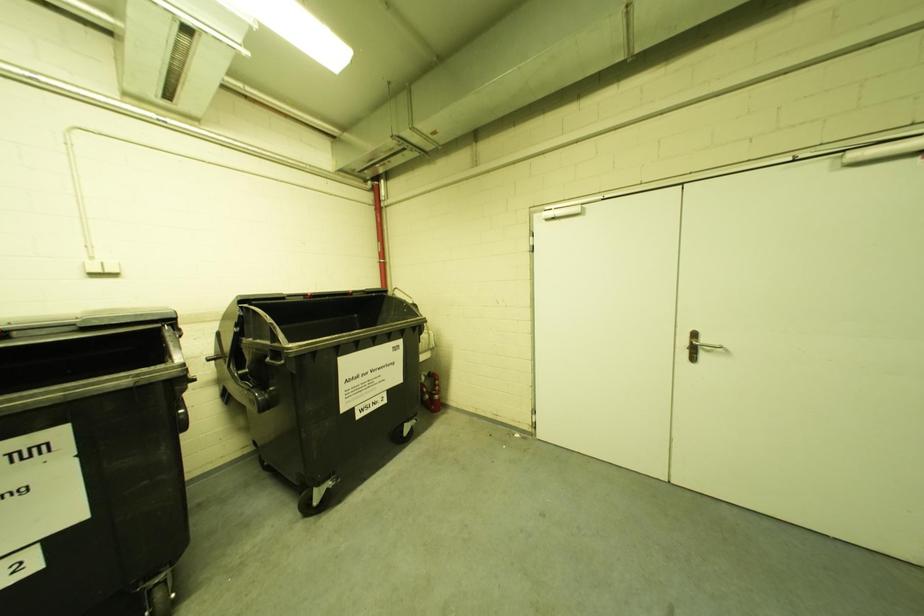
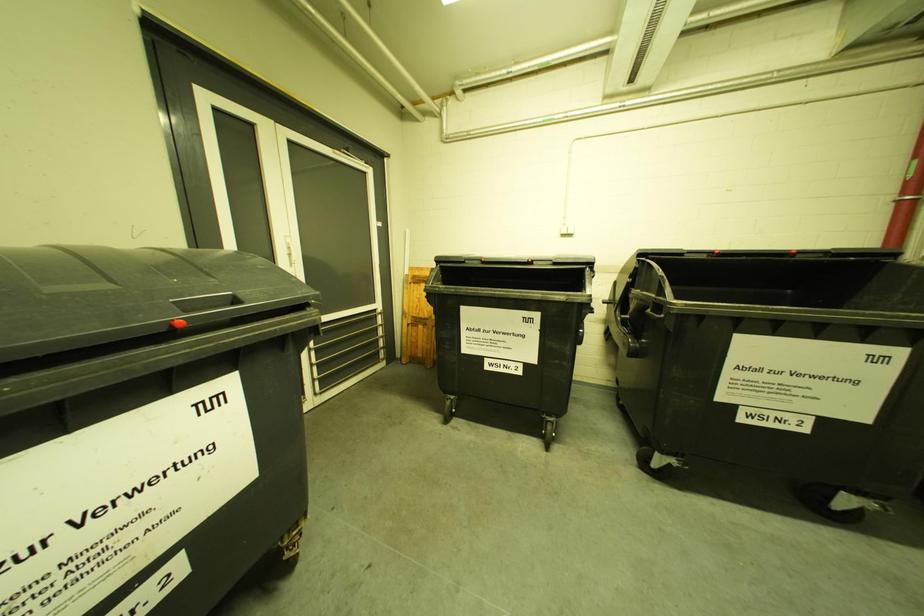
Question: How did the camera likely rotate?

Choices:
 (A) Left
 (B) Right
 (C) Up
 (D) Down

Answer: (A)